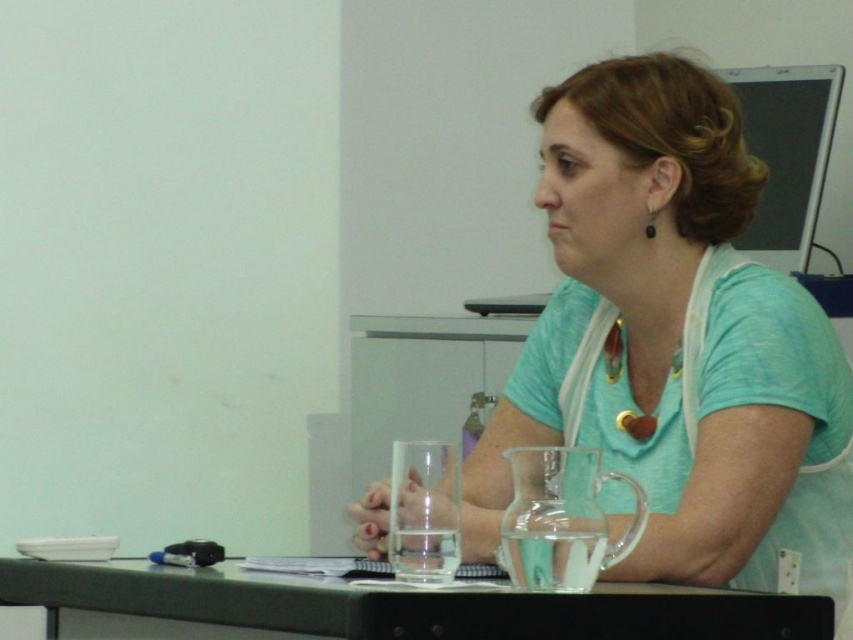
Consider the image. Does matte teal shirt at center appear over black plastic table at lower center?

Correct, matte teal shirt at center is located above black plastic table at lower center.

Can you confirm if matte teal shirt at center is smaller than black plastic table at lower center?

No.

Which is in front, point (683, 547) or point (706, 634)?

Point (706, 634) is more forward.

Image resolution: width=853 pixels, height=640 pixels. What are the coordinates of `matte teal shirt at center` in the screenshot? It's located at (674, 342).